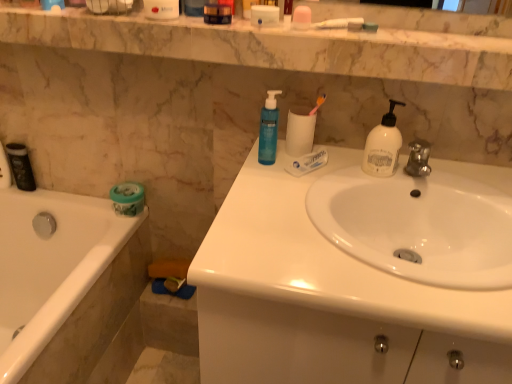
Where is `vacant region to the left of translucent white tube at center`? This screenshot has width=512, height=384. vacant region to the left of translucent white tube at center is located at coordinates (266, 173).